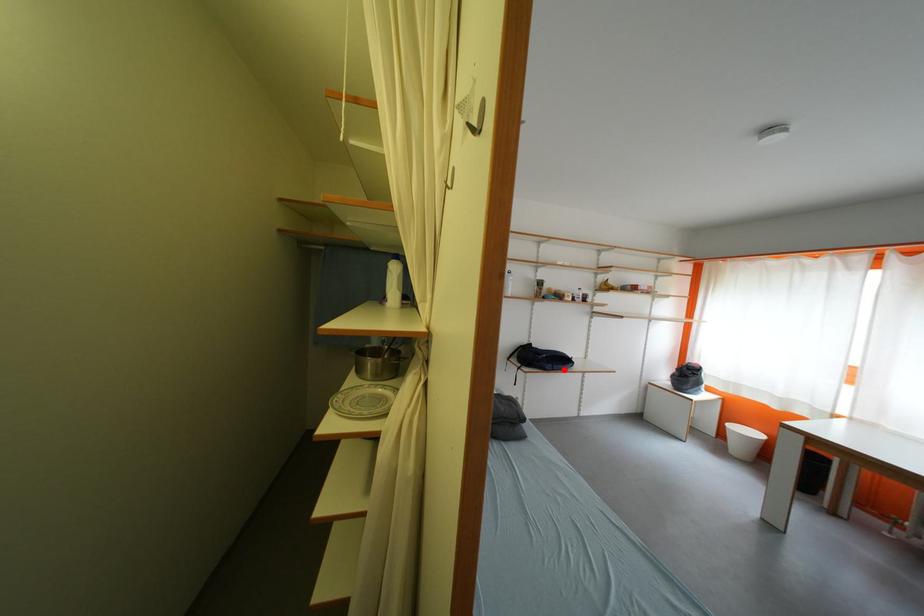
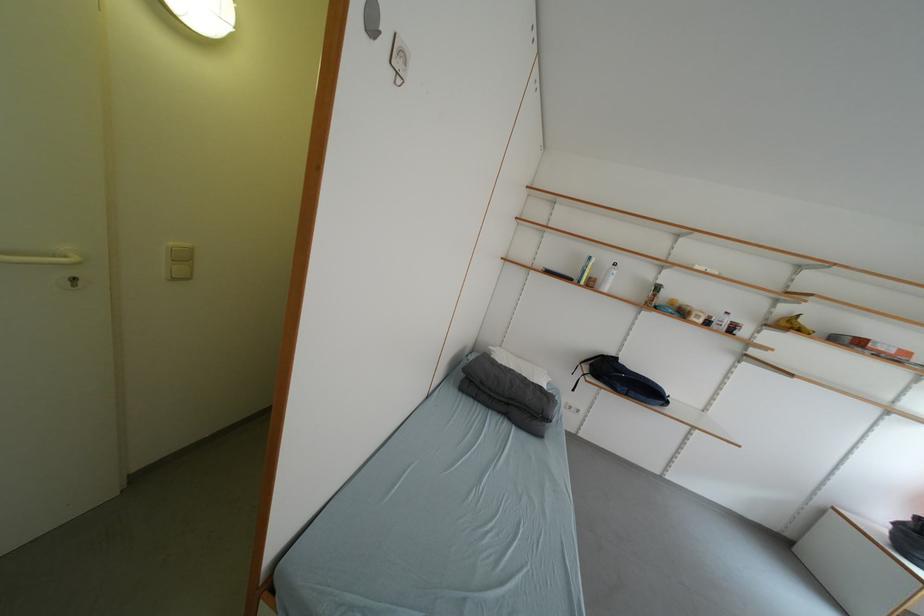
Question: I am providing you with two images of the same scene from different viewpoints. In image1, a red point is highlighted. Considering the same 3D point in image2, which of the following is correct?

Choices:
 (A) It is closer
 (B) It is farther

Answer: (A)